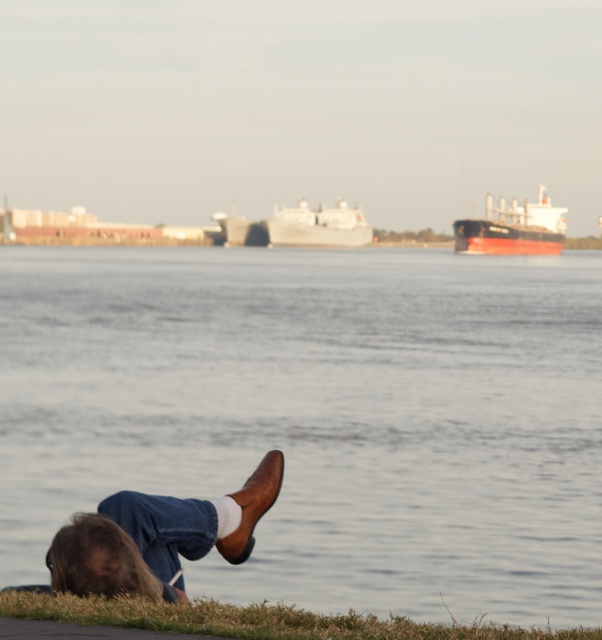
You are a photographer wanting to capture the brown leather shoe at lower center and the green grass at lower center in a single frame. Which object will appear wider in the photo?

The green grass at lower center will appear wider in the photo because the brown leather shoe at lower center has a lesser width compared to green grass at lower center.

You are planning to set up a small tent in the grassy area near the riverbank. Based on the scene, which area has a wider space between the clear water at lower center and the green grass at lower center?

The clear water at lower center has a wider space than the green grass at lower center.

You are a photographer planning to take a photo of the metallic gray ship at center from the clear water at lower center. Can you see the ship in the water reflection?

The clear water at lower center is located below the metallic gray ship at center, so yes, the reflection of the metallic gray ship at center would be visible in the clear water at lower center.